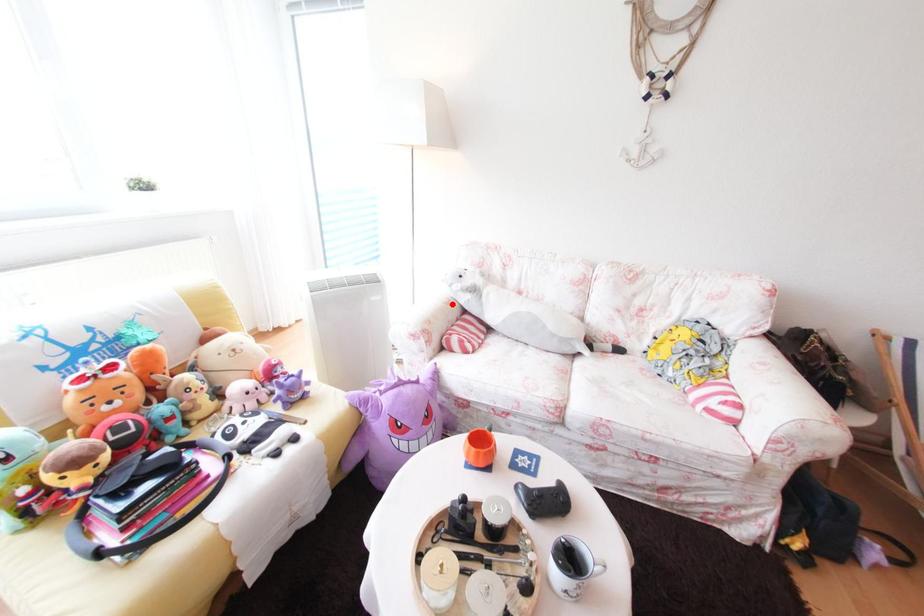
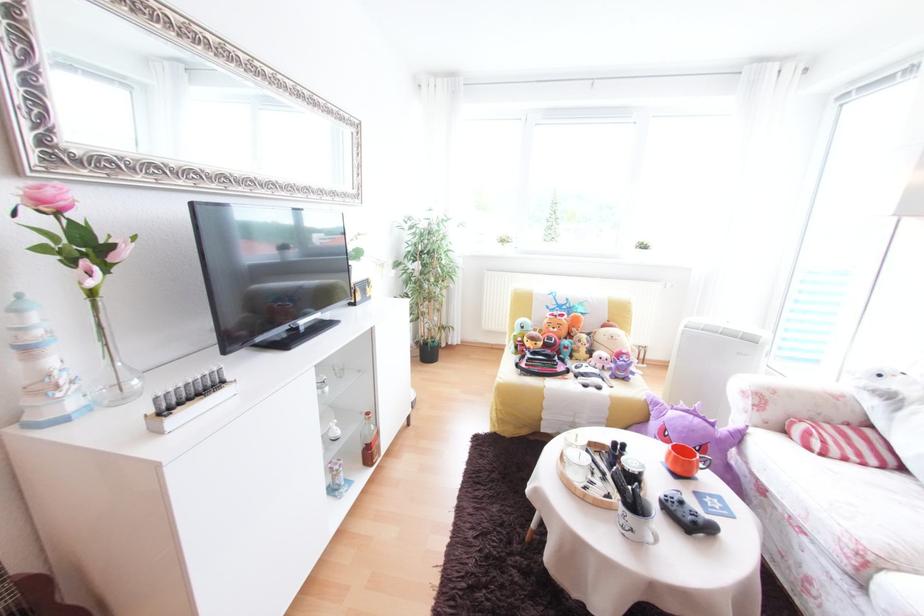
In the second image, find the point that corresponds to the highlighted location in the first image.

(834, 392)